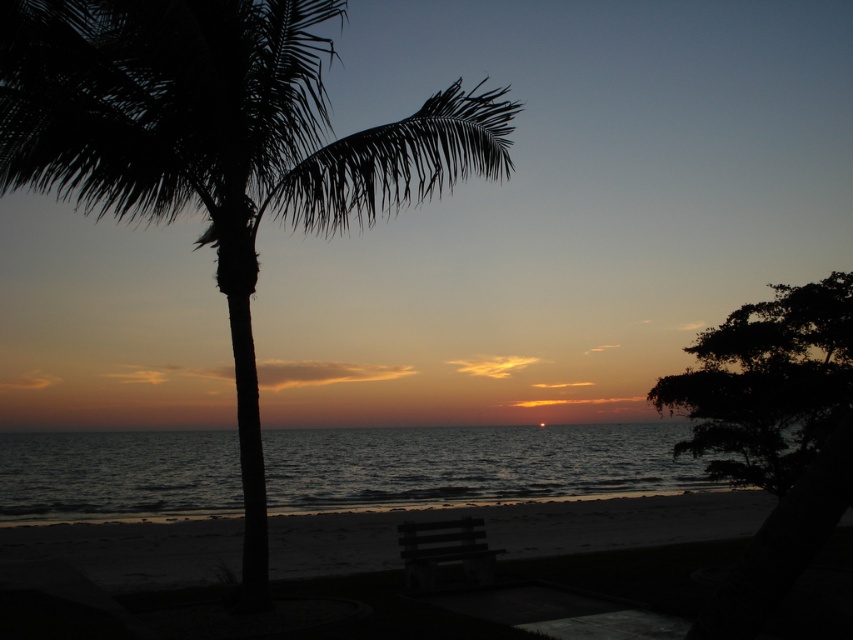
Does silhouette leafy palm at left lie behind dark blue water at center?

No, silhouette leafy palm at left is closer to the viewer.

Can you confirm if silhouette leafy palm at left is positioned to the left of dark blue water at center?

In fact, silhouette leafy palm at left is to the right of dark blue water at center.

Locate an element on the screen. silhouette leafy palm at left is located at coordinates 219,145.

This screenshot has width=853, height=640. I want to click on silhouette leafy palm at left, so click(219, 145).

Is silhouette leafy palm at left smaller than dark wood bench at lower center?

No.

Is point (149, 113) behind point (413, 529)?

No, it is not.

Identify the location of silhouette leafy palm at left. The image size is (853, 640). (219, 145).

Which is in front, point (728, 529) or point (486, 544)?

Point (486, 544)

Can you confirm if smooth sand at lower center is smaller than dark wood bench at lower center?

No.

This screenshot has width=853, height=640. Identify the location of smooth sand at lower center. (517, 529).

Locate an element on the screen. smooth sand at lower center is located at coordinates (517, 529).